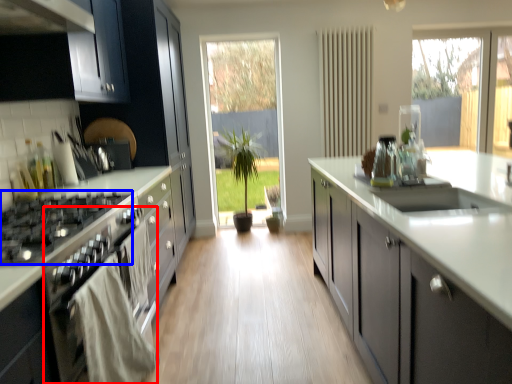
Question: Which point is closer to the camera, oven (highlighted by a red box) or gas stove (highlighted by a blue box)?

Choices:
 (A) oven
 (B) gas stove

Answer: (A)